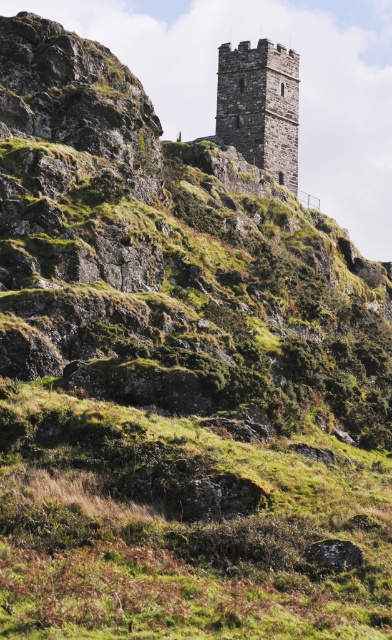
Can you confirm if green grassy at center is taller than stone tower at upper center?

In fact, green grassy at center may be shorter than stone tower at upper center.

The height and width of the screenshot is (640, 392). What do you see at coordinates (181, 528) in the screenshot?
I see `green grassy at center` at bounding box center [181, 528].

Locate an element on the screen. Image resolution: width=392 pixels, height=640 pixels. green grassy at center is located at coordinates (181, 528).